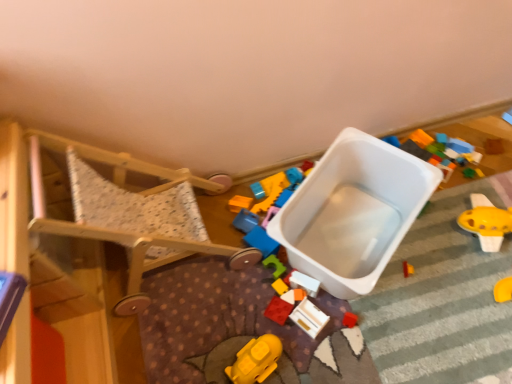
In order to click on free space to the left of wooden toy at center, the second toy in the right-to-left sequence in this screenshot , I will do `click(252, 317)`.